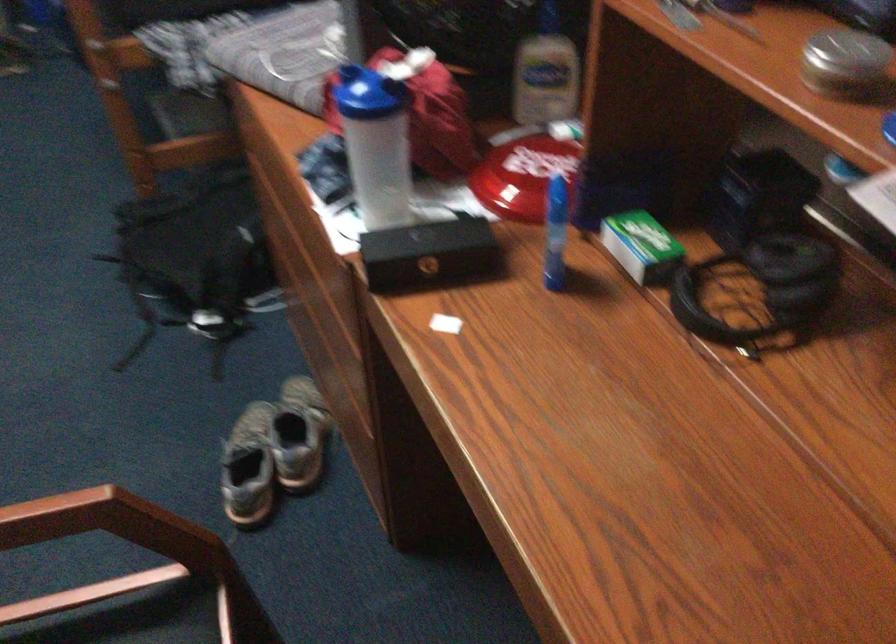
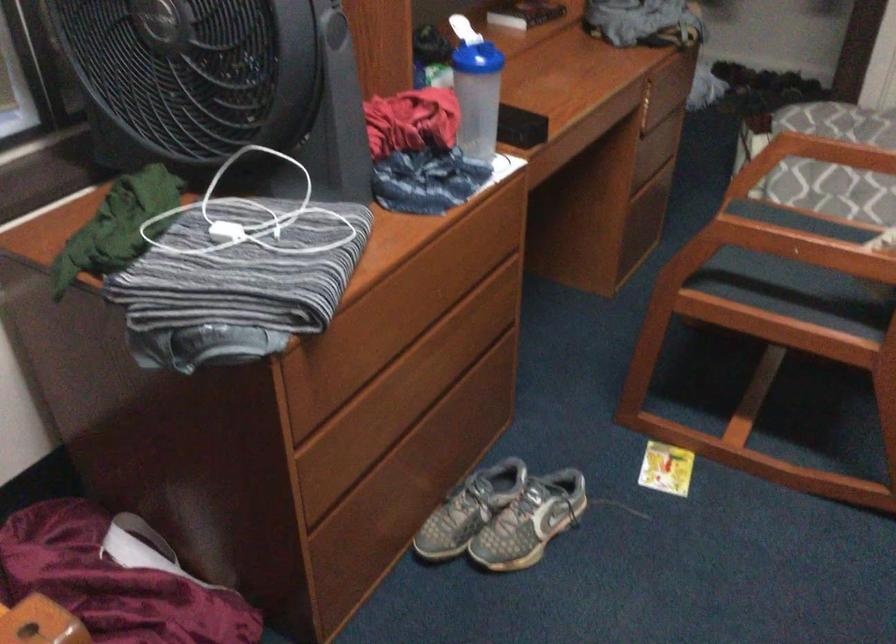
In the second image, find the point that corresponds to [366,142] in the first image.

(478, 97)